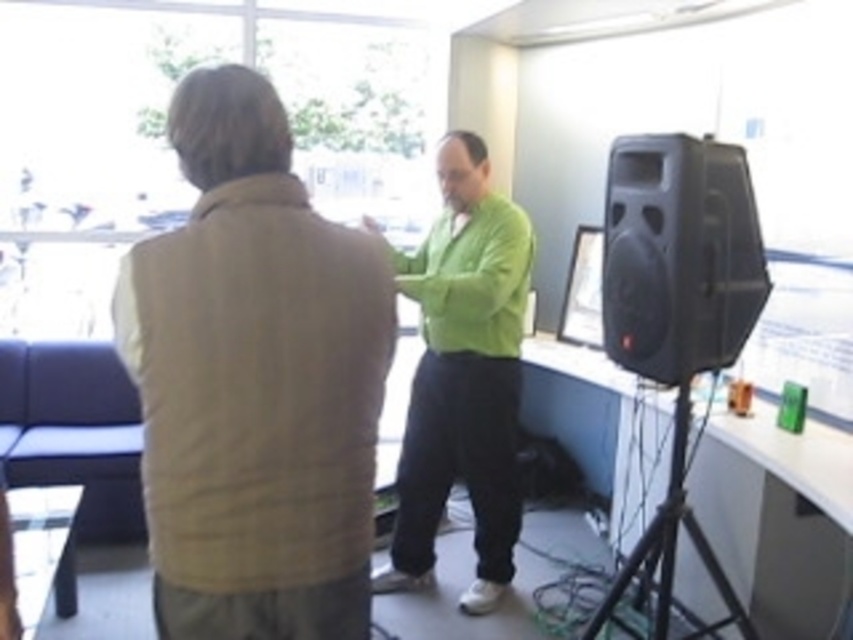
Question: Which object is the closest to the matte black speaker at right?

Choices:
 (A) beige woolen vest at upper left
 (B) green matte sweater at center
 (C) black matte speaker at right

Answer: (B)

Question: Based on their relative distances, which object is farther from the black matte speaker at right?

Choices:
 (A) green matte sweater at center
 (B) beige woolen vest at upper left
 (C) matte black speaker at right

Answer: (C)

Question: Does green matte sweater at center have a greater width compared to black matte speaker at right?

Choices:
 (A) no
 (B) yes

Answer: (B)

Question: Which is farther from the beige woolen vest at upper left?

Choices:
 (A) green matte sweater at center
 (B) black matte speaker at right
 (C) matte black speaker at right

Answer: (C)

Question: Is green matte sweater at center above black matte speaker at right?

Choices:
 (A) no
 (B) yes

Answer: (A)

Question: In this image, where is beige woolen vest at upper left located relative to black matte speaker at right?

Choices:
 (A) left
 (B) right

Answer: (A)